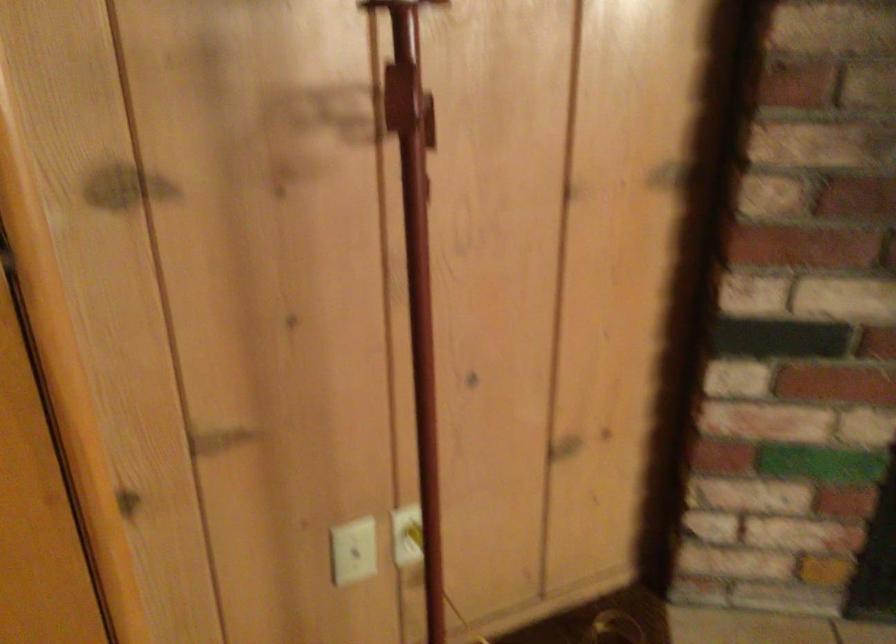
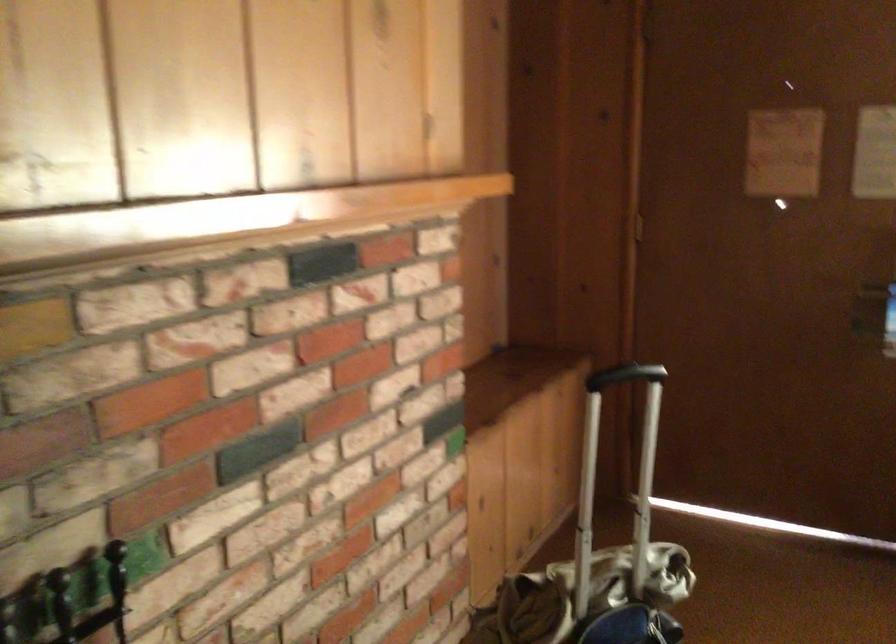
Question: How did the camera likely rotate?

Choices:
 (A) Left
 (B) Right
 (C) Up
 (D) Down

Answer: (B)